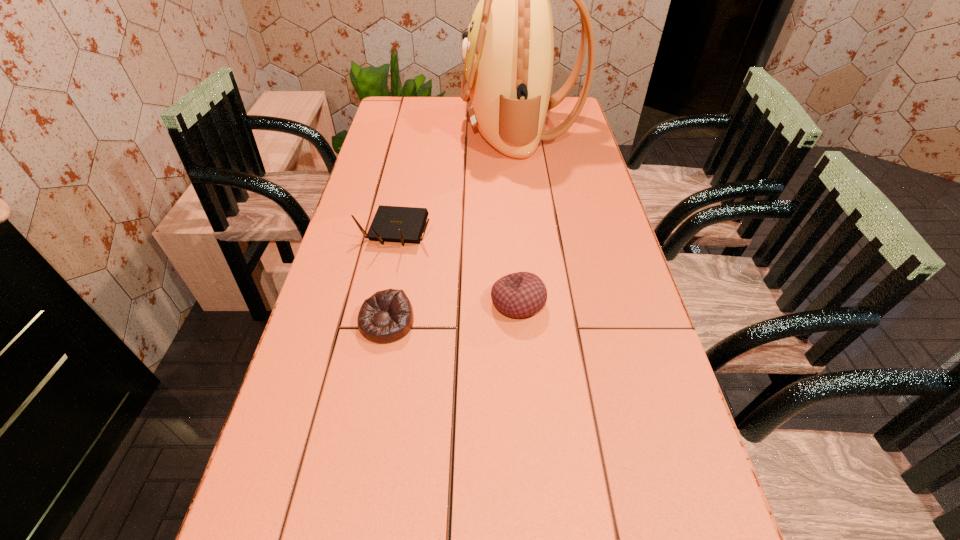
Identify the location of object that is the second closest to the left beanbag. The image size is (960, 540). (518, 295).

You are a GUI agent. You are given a task and a screenshot of the screen. Output one action in this format:
    pyautogui.click(x=<x>, y=<y>)
    Task: Click on the object that is the second closest to the shortest object
    The height and width of the screenshot is (540, 960).
    Given the screenshot: What is the action you would take?
    pyautogui.click(x=518, y=295)

The image size is (960, 540). In order to click on vacant space that satisfies the following two spatial constraints: 1. on the front-facing side of the tallest object; 2. on the front side of the router in this screenshot , I will do `click(532, 232)`.

Locate an element on the screen. This screenshot has height=540, width=960. vacant area that satisfies the following two spatial constraints: 1. on the front-facing side of the tallest object; 2. on the front side of the shortest object is located at coordinates pyautogui.click(x=543, y=323).